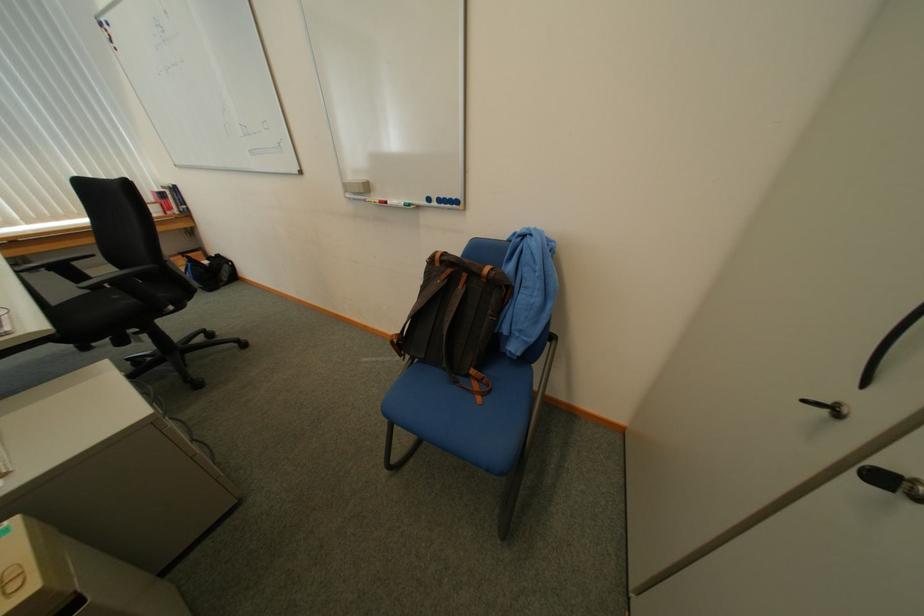
Find where to sit the blue chair sitting surface. Please return your answer as a coordinate pair (x, y).

(463, 407)